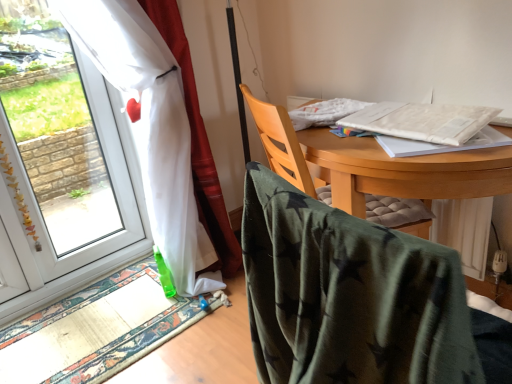
Question: Does white matte notebook at upper right, arranged as the second notebook when ordered from the bottom, come behind white sheer curtain at left?

Choices:
 (A) no
 (B) yes

Answer: (A)

Question: Is white matte notebook at upper right, arranged as the second notebook when ordered from the bottom, positioned beyond the bounds of white sheer curtain at left?

Choices:
 (A) no
 (B) yes

Answer: (B)

Question: Considering the relative sizes of white matte notebook at upper right, which appears as the 1th notebook when viewed from the top, and white sheer curtain at left in the image provided, is white matte notebook at upper right, which appears as the 1th notebook when viewed from the top, taller than white sheer curtain at left?

Choices:
 (A) yes
 (B) no

Answer: (B)

Question: Can you confirm if white matte notebook at upper right, arranged as the second notebook when ordered from the bottom, is shorter than white sheer curtain at left?

Choices:
 (A) no
 (B) yes

Answer: (B)

Question: Is white matte notebook at upper right, arranged as the second notebook when ordered from the bottom, in contact with white sheer curtain at left?

Choices:
 (A) no
 (B) yes

Answer: (A)

Question: Is white sheer curtain at left at the back of white matte notebook at upper right, arranged as the second notebook when ordered from the bottom?

Choices:
 (A) no
 (B) yes

Answer: (A)

Question: From the image's perspective, is transparent glass window at left over wooden chair at center, which appears as the 2th chair when viewed from the front?

Choices:
 (A) no
 (B) yes

Answer: (B)

Question: Can you confirm if transparent glass window at left is shorter than wooden chair at center, which is counted as the first chair, starting from the back?

Choices:
 (A) yes
 (B) no

Answer: (B)

Question: Is transparent glass window at left in front of wooden chair at center, which appears as the 2th chair when viewed from the front?

Choices:
 (A) no
 (B) yes

Answer: (A)

Question: Is wooden chair at center, which is counted as the first chair, starting from the back, at the back of transparent glass window at left?

Choices:
 (A) yes
 (B) no

Answer: (B)

Question: From a real-world perspective, is transparent glass window at left on top of wooden chair at center, which appears as the 2th chair when viewed from the front?

Choices:
 (A) no
 (B) yes

Answer: (B)

Question: Is transparent glass window at left not close to wooden chair at center, which appears as the 2th chair when viewed from the front?

Choices:
 (A) no
 (B) yes

Answer: (B)

Question: Are green fabric mat at lower left and wooden chair at center, which appears as the 2th chair when viewed from the front, making contact?

Choices:
 (A) no
 (B) yes

Answer: (A)